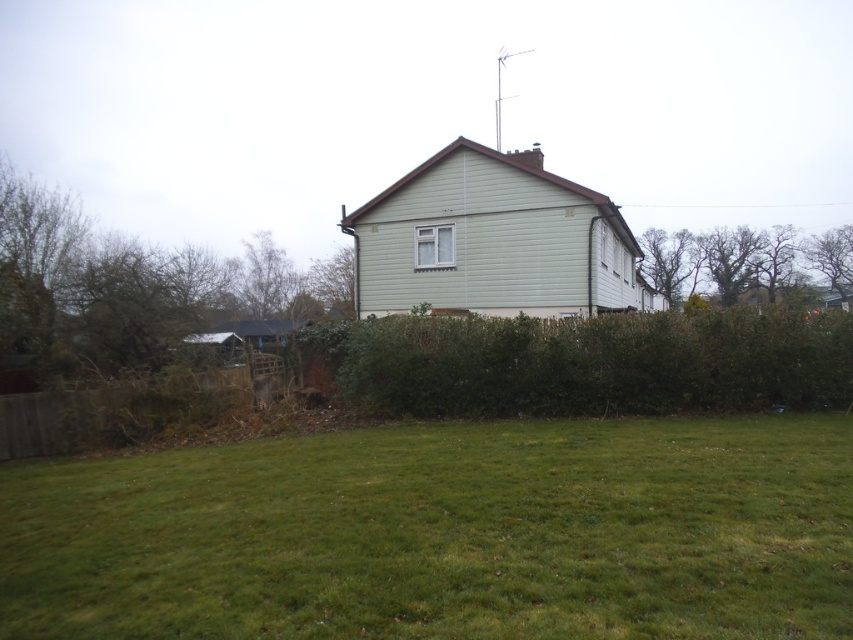
Question: Is green grass at lower center closer to camera compared to green leafy hedge at center?

Choices:
 (A) no
 (B) yes

Answer: (B)

Question: Does green grass at lower center have a larger size compared to green leafy hedge at center?

Choices:
 (A) yes
 (B) no

Answer: (B)

Question: Is green grass at lower center positioned behind green leafy hedge at center?

Choices:
 (A) yes
 (B) no

Answer: (B)

Question: Among these objects, which one is farthest from the camera?

Choices:
 (A) green leafy hedge at center
 (B) green grass at lower center

Answer: (A)

Question: Which point is closer to the camera?

Choices:
 (A) (564, 468)
 (B) (761, 385)

Answer: (A)